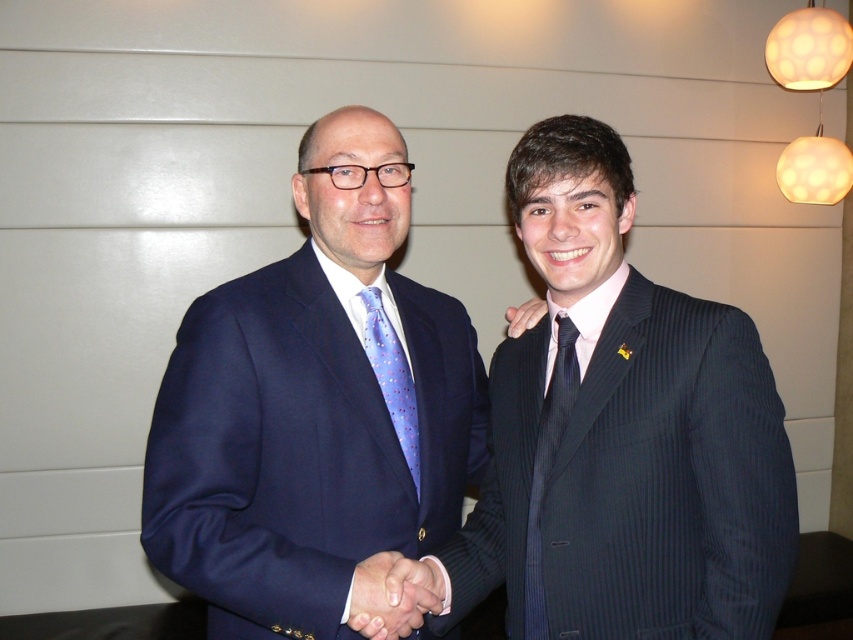
Which is more to the left, matte blue suit at center or black silk tie at right?

matte blue suit at center

In the scene shown: Is matte blue suit at center taller than black silk tie at right?

Yes, matte blue suit at center is taller than black silk tie at right.

Who is more distant from viewer, (160, 426) or (537, 461)?

Point (537, 461)

Find the location of a particular element. matte blue suit at center is located at coordinates (312, 408).

Identify the location of dark blue pinstripe suit at center. point(622,435).

Between dark blue pinstripe suit at center and smooth leather hand at center, which one has less height?

smooth leather hand at center

At what (x,y) coordinates should I click in order to perform the action: click on dark blue pinstripe suit at center. Please return your answer as a coordinate pair (x, y). Image resolution: width=853 pixels, height=640 pixels. Looking at the image, I should click on (x=622, y=435).

Is the position of dark blue pinstripe suit at center less distant than that of matte black hand at center?

Yes, dark blue pinstripe suit at center is in front of matte black hand at center.

Who is lower down, dark blue pinstripe suit at center or matte black hand at center?

dark blue pinstripe suit at center

Where is `dark blue pinstripe suit at center`? dark blue pinstripe suit at center is located at coordinates (x=622, y=435).

Where is `dark blue pinstripe suit at center`? The height and width of the screenshot is (640, 853). dark blue pinstripe suit at center is located at coordinates (622, 435).